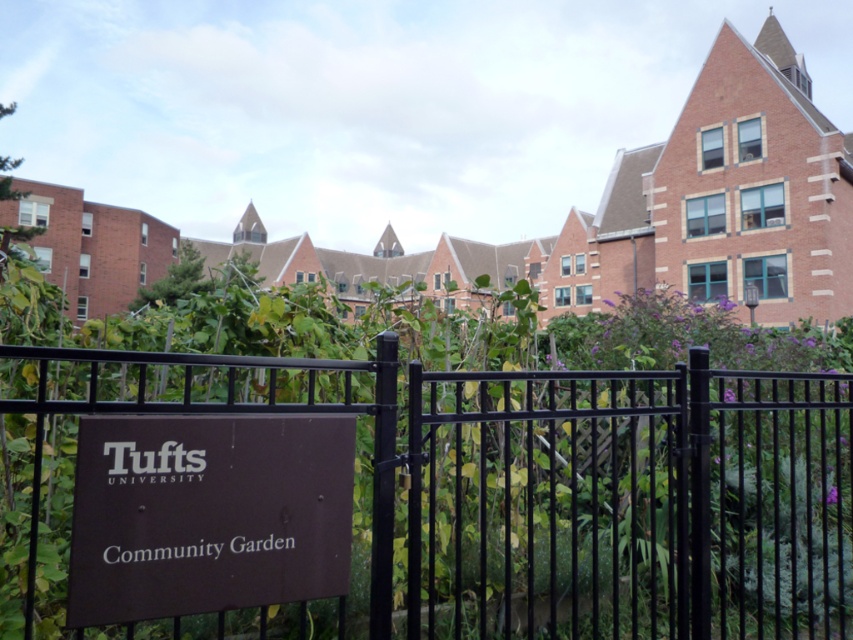
Question: Which object appears farthest from the camera in this image?

Choices:
 (A) brown matte sign at lower center
 (B) black metal fence at center

Answer: (A)

Question: Does black metal fence at center come behind brown matte sign at lower center?

Choices:
 (A) yes
 (B) no

Answer: (B)

Question: Can you confirm if black metal fence at center is thinner than brown matte sign at lower center?

Choices:
 (A) yes
 (B) no

Answer: (B)

Question: Which point is closer to the camera?

Choices:
 (A) (669, 563)
 (B) (157, 616)

Answer: (B)

Question: Considering the relative positions of black metal fence at center and brown matte sign at lower center in the image provided, where is black metal fence at center located with respect to brown matte sign at lower center?

Choices:
 (A) left
 (B) right

Answer: (B)